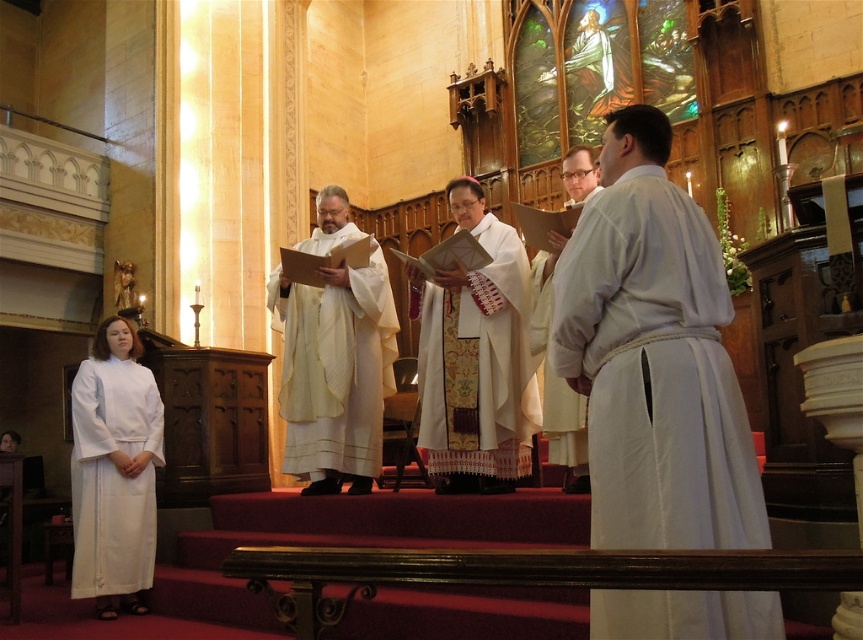
You are an attendee at the church service and need to locate the clergy members. Based on the description, which robe is positioned higher up in the image, the white matte robe at center or the white satin robe at center?

The white satin robe at center is positioned higher up because the white matte robe at center is located below it.

From the picture: Based on the scene description, can you determine which object is wider between the white matte robe at center and the white clothed man at center?

The white matte robe at center is wider than the white clothed man at center according to the description.